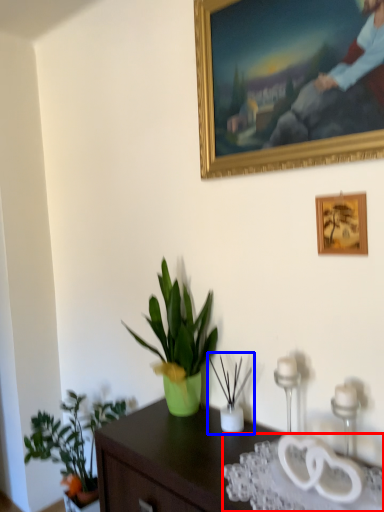
Question: Which object is closer to the camera taking this photo, glass table (highlighted by a red box) or houseplant (highlighted by a blue box)?

Choices:
 (A) glass table
 (B) houseplant

Answer: (A)